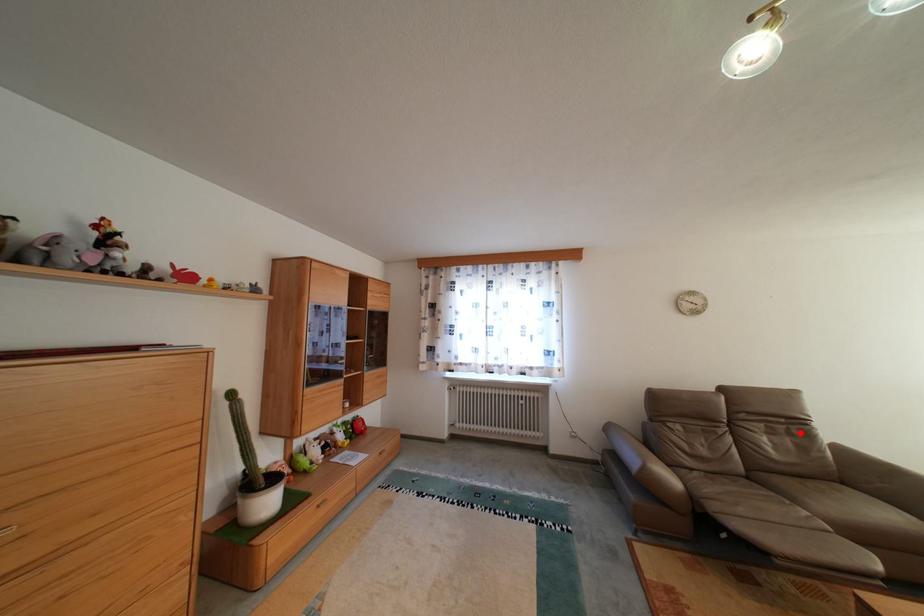
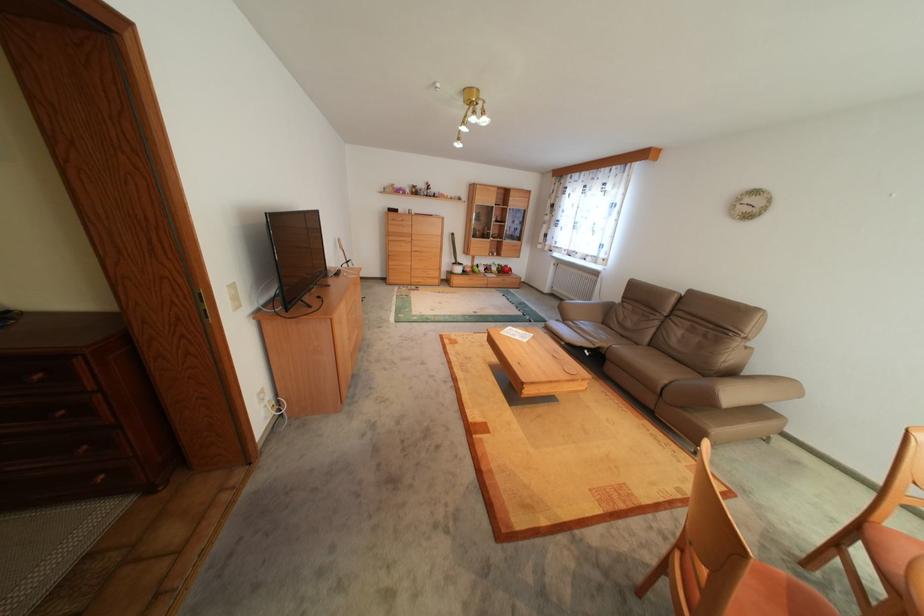
Question: I am providing you with two images of the same scene from different viewpoints. In image1, a red point is highlighted. Considering the same 3D point in image2, which of the following is correct?

Choices:
 (A) It is closer
 (B) It is farther

Answer: (B)